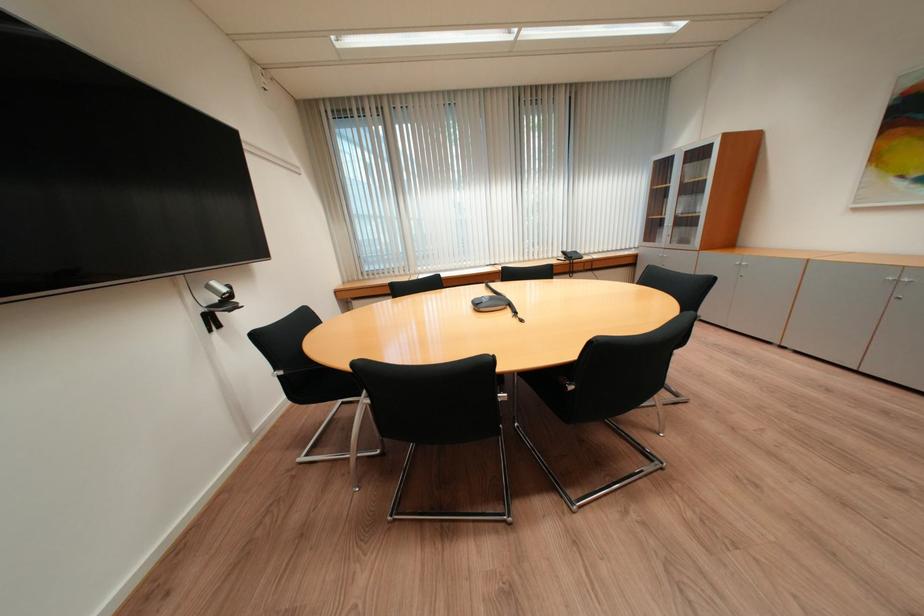
The width and height of the screenshot is (924, 616). I want to click on conference phone, so click(490, 301).